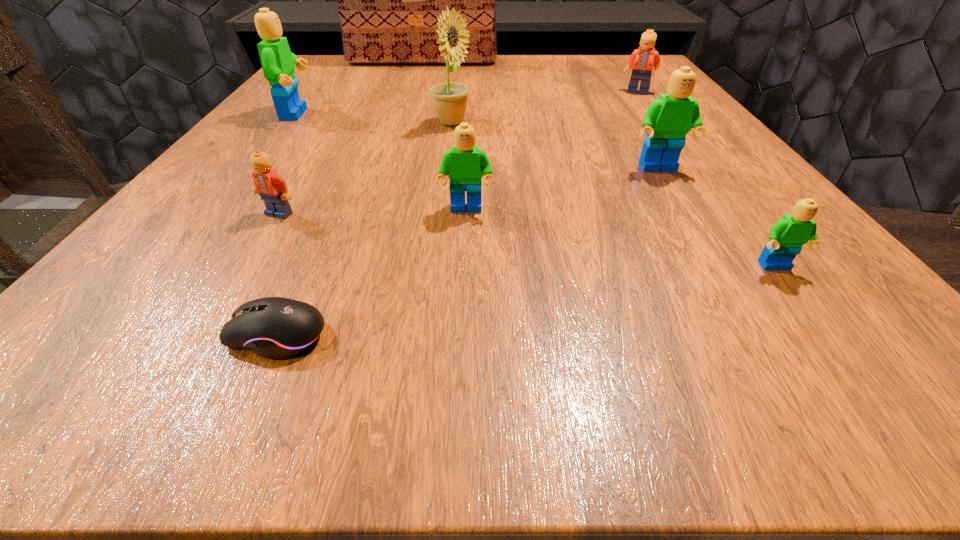
Image resolution: width=960 pixels, height=540 pixels. I want to click on the third biggest green Lego, so click(466, 165).

Where is `the nearer orange Lego`? The height and width of the screenshot is (540, 960). the nearer orange Lego is located at coordinates (272, 189).

You are a GUI agent. You are given a task and a screenshot of the screen. Output one action in this format:
    pyautogui.click(x=<x>, y=<y>)
    Task: Click on the smaller orange Lego
    This screenshot has height=540, width=960.
    Given the screenshot: What is the action you would take?
    pyautogui.click(x=272, y=189)

This screenshot has height=540, width=960. What are the coordinates of `the nearest Lego` in the screenshot? It's located at (787, 236).

Locate an element on the screen. Image resolution: width=960 pixels, height=540 pixels. the smallest green Lego is located at coordinates (787, 236).

Locate an element on the screen. computer mouse is located at coordinates (276, 328).

At what (x,y) coordinates should I click in order to perform the action: click on the nearest object. Please return your answer as a coordinate pair (x, y). This screenshot has height=540, width=960. Looking at the image, I should click on (276, 328).

I want to click on free space located on the front of the brown handbag with the clasp, so click(408, 105).

You are a GUI agent. You are given a task and a screenshot of the screen. Output one action in this format:
    pyautogui.click(x=<x>, y=<y>)
    Task: Click on the vacant area situated 0.300m on the face of the yellow sunflower
    
    Given the screenshot: What is the action you would take?
    pyautogui.click(x=632, y=123)

At what (x,y) coordinates should I click in order to perform the action: click on free spot located on the face of the leftmost green Lego. Please return your answer as a coordinate pair (x, y). This screenshot has width=960, height=540. Looking at the image, I should click on (342, 114).